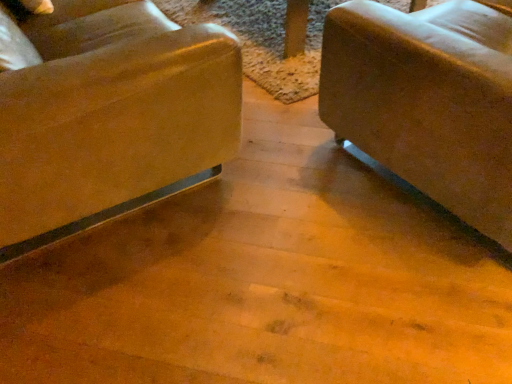
Where is `matte brown chair at left`? Image resolution: width=512 pixels, height=384 pixels. matte brown chair at left is located at coordinates (111, 118).

Describe the element at coordinates (111, 118) in the screenshot. I see `matte brown chair at left` at that location.

Measure the distance between suede-like beige couch at right and camera.

The distance of suede-like beige couch at right from camera is 1.07 meters.

Describe the element at coordinates (428, 100) in the screenshot. This screenshot has height=384, width=512. I see `suede-like beige couch at right` at that location.

At what (x,y) coordinates should I click in order to perform the action: click on suede-like beige couch at right. Please return your answer as a coordinate pair (x, y). The width and height of the screenshot is (512, 384). Looking at the image, I should click on (428, 100).

I want to click on matte brown chair at left, so click(x=111, y=118).

Visually, is matte brown chair at left positioned to the left or to the right of suede-like beige couch at right?

matte brown chair at left is positioned on suede-like beige couch at right's left side.

Which is behind, matte brown chair at left or suede-like beige couch at right?

Positioned behind is suede-like beige couch at right.

Does point (17, 154) lie behind point (505, 10)?

No.

From the image's perspective, is matte brown chair at left under suede-like beige couch at right?

No, from the image's perspective, matte brown chair at left is not below suede-like beige couch at right.

From a real-world perspective, is matte brown chair at left on suede-like beige couch at right?

Incorrect, from a real-world perspective, matte brown chair at left is lower than suede-like beige couch at right.

Is matte brown chair at left thinner than suede-like beige couch at right?

Indeed, matte brown chair at left has a lesser width compared to suede-like beige couch at right.

From the picture: Considering the sizes of objects matte brown chair at left and suede-like beige couch at right in the image provided, who is shorter, matte brown chair at left or suede-like beige couch at right?

suede-like beige couch at right is shorter.

Is matte brown chair at left bigger or smaller than suede-like beige couch at right?

In the image, matte brown chair at left appears to be larger than suede-like beige couch at right.

Do you think matte brown chair at left is within suede-like beige couch at right, or outside of it?

matte brown chair at left is not inside suede-like beige couch at right, it's outside.

Is matte brown chair at left far away from suede-like beige couch at right?

matte brown chair at left is actually quite close to suede-like beige couch at right.

Could you tell me if matte brown chair at left is facing suede-like beige couch at right?

Yes, matte brown chair at left is turned towards suede-like beige couch at right.

Where is `studio couch behind the matte brown chair at left`? studio couch behind the matte brown chair at left is located at coordinates click(x=428, y=100).

Considering the relative positions of suede-like beige couch at right and matte brown chair at left in the image provided, is suede-like beige couch at right to the right of matte brown chair at left from the viewer's perspective?

Yes, suede-like beige couch at right is to the right of matte brown chair at left.

In the image, is suede-like beige couch at right positioned in front of or behind matte brown chair at left?

Visually, suede-like beige couch at right is located behind matte brown chair at left.

Considering the points (488, 75) and (132, 144), which point is behind, point (488, 75) or point (132, 144)?

The point (132, 144) is behind.

From the image's perspective, is suede-like beige couch at right over matte brown chair at left?

No, from the image's perspective, suede-like beige couch at right is not above matte brown chair at left.

From a real-world perspective, who is located lower, suede-like beige couch at right or matte brown chair at left?

matte brown chair at left, from a real-world perspective.

Based on the photo, between suede-like beige couch at right and matte brown chair at left, which one has smaller width?

matte brown chair at left is thinner.

Considering the sizes of objects suede-like beige couch at right and matte brown chair at left in the image provided, who is shorter, suede-like beige couch at right or matte brown chair at left?

suede-like beige couch at right.

Considering the sizes of objects suede-like beige couch at right and matte brown chair at left in the image provided, who is smaller, suede-like beige couch at right or matte brown chair at left?

Smaller between the two is suede-like beige couch at right.

Choose the correct answer: Is suede-like beige couch at right inside matte brown chair at left or outside it?

The correct answer is: outside.

Are suede-like beige couch at right and matte brown chair at left beside each other?

No, suede-like beige couch at right is not beside matte brown chair at left.

Does suede-like beige couch at right turn towards matte brown chair at left?

No, suede-like beige couch at right is not oriented towards matte brown chair at left.

How many degrees apart are the facing directions of suede-like beige couch at right and matte brown chair at left?

suede-like beige couch at right and matte brown chair at left are facing 92.4 degrees away from each other.

In the image, there is a suede-like beige couch at right. Where is `chair below it (from a real-world perspective)`? This screenshot has width=512, height=384. chair below it (from a real-world perspective) is located at coordinates (111, 118).

What are the coordinates of `studio couch located above the matte brown chair at left (from a real-world perspective)` in the screenshot? It's located at (428, 100).

Where is `chair in front of the suede-like beige couch at right`? This screenshot has height=384, width=512. chair in front of the suede-like beige couch at right is located at coordinates (111, 118).